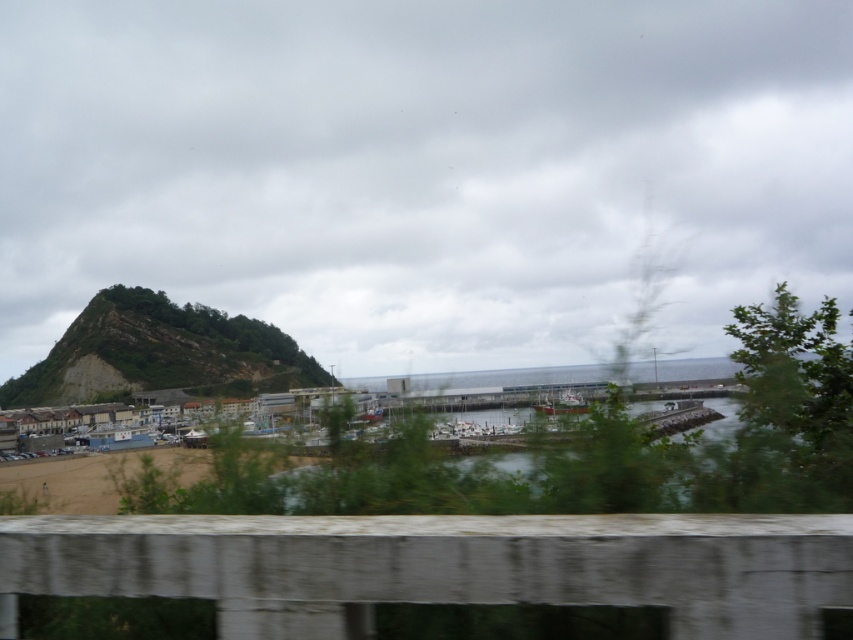
Question: Is green rocky hill at left in front of brown sand at lower left?

Choices:
 (A) yes
 (B) no

Answer: (B)

Question: Which point is closer to the camera taking this photo?

Choices:
 (A) (544, 636)
 (B) (701, 419)

Answer: (A)

Question: Can you confirm if green rocky hill at left is smaller than transparent glass train window at center?

Choices:
 (A) yes
 (B) no

Answer: (B)

Question: Which point is farther from the camera taking this photo?

Choices:
 (A) (88, 464)
 (B) (160, 337)
 (C) (332, 492)

Answer: (B)

Question: Which object appears closest to the camera in this image?

Choices:
 (A) clear water at center
 (B) transparent glass train window at center

Answer: (B)

Question: Is green rocky hill at left behind transparent glass train window at center?

Choices:
 (A) no
 (B) yes

Answer: (B)